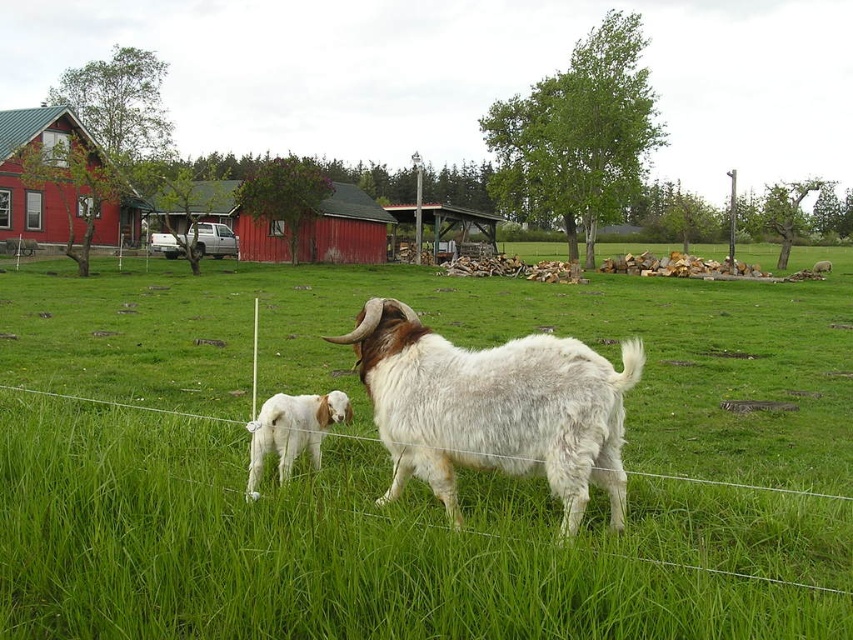
You are a farmer checking the fence around your farm. You notice the red wooden barn at left and the white woolen goat at lower left. Which structure or animal occupies more horizontal space in the image?

The red wooden barn at left is wider than the white woolen goat at lower left, so the barn occupies more horizontal space.

You are a farmer who needs to transport hay from the green grassy field at center to the red wooden barn at left. Your tractor can carry hay bales weighing up to 2000 pounds. Each hay bale weighs 50 pounds and takes up 2 cubic feet of space. The tractor has a maximum capacity of 1000 cubic feet. How many hay bales can you transport in one trip without exceeding either weight or space limits?

The tractor can carry a maximum of 2000 pounds, and each hay bale weighs 50 pounds, so 2000 divided by 50 equals 40 hay bales. The tractor also has a space limit of 1000 cubic feet, and each bale takes 2 cubic feet, so 1000 divided by 2 equals 500 hay bales. The limiting factor is the weight, so you can transport 40 hay bales in one trip.